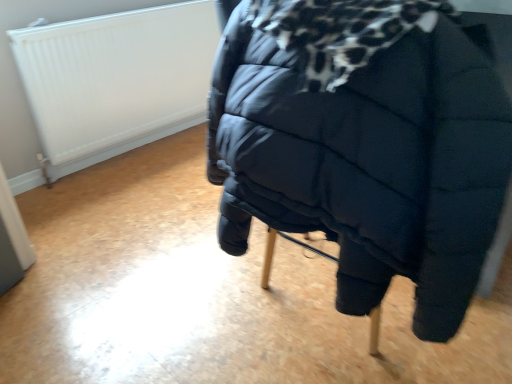
In order to face black quilted bed at center, should I rotate leftwards or rightwards?

Rotate your view right by about 10.780°.

Identify the location of black quilted bed at center. The height and width of the screenshot is (384, 512). (367, 145).

What do you see at coordinates (367, 145) in the screenshot? I see `black quilted bed at center` at bounding box center [367, 145].

You are a GUI agent. You are given a task and a screenshot of the screen. Output one action in this format:
    pyautogui.click(x=<x>, y=<y>)
    Task: Click on the white textured radiator at upper left
    Image resolution: width=512 pixels, height=384 pixels.
    Given the screenshot: What is the action you would take?
    pyautogui.click(x=116, y=79)

The height and width of the screenshot is (384, 512). What do you see at coordinates (116, 79) in the screenshot? I see `white textured radiator at upper left` at bounding box center [116, 79].

Locate an element on the screen. black quilted bed at center is located at coordinates (367, 145).

Does black quilted bed at center appear on the left side of white textured radiator at upper left?

No, black quilted bed at center is not to the left of white textured radiator at upper left.

Relative to white textured radiator at upper left, is black quilted bed at center in front or behind?

Visually, black quilted bed at center is located in front of white textured radiator at upper left.

Between point (395, 169) and point (94, 30), which one is positioned behind?

The point (94, 30) is more distant.

From the image's perspective, which one is positioned lower, black quilted bed at center or white textured radiator at upper left?

black quilted bed at center is shown below in the image.

From a real-world perspective, is black quilted bed at center below white textured radiator at upper left?

No, from a real-world perspective, black quilted bed at center is not beneath white textured radiator at upper left.

Between black quilted bed at center and white textured radiator at upper left, which one has larger width?

black quilted bed at center is wider.

Can you confirm if black quilted bed at center is shorter than white textured radiator at upper left?

Yes.

Considering the sizes of black quilted bed at center and white textured radiator at upper left in the image, is black quilted bed at center bigger or smaller than white textured radiator at upper left?

Clearly, black quilted bed at center is larger in size than white textured radiator at upper left.

Is black quilted bed at center completely or partially outside of white textured radiator at upper left?

Absolutely, black quilted bed at center is external to white textured radiator at upper left.

Is black quilted bed at center far away from white textured radiator at upper left?

Yes, black quilted bed at center and white textured radiator at upper left are quite far apart.

Is black quilted bed at center facing towards white textured radiator at upper left?

No, black quilted bed at center is not turned towards white textured radiator at upper left.

In the scene shown: Can you tell me how much black quilted bed at center and white textured radiator at upper left differ in facing direction?

90.9 degrees separate the facing orientations of black quilted bed at center and white textured radiator at upper left.

Locate an element on the screen. The height and width of the screenshot is (384, 512). radiator above the black quilted bed at center (from the image's perspective) is located at coordinates (116, 79).

In the scene shown: In the image, is white textured radiator at upper left on the left side or the right side of black quilted bed at center?

white textured radiator at upper left is to the left of black quilted bed at center.

Is the position of white textured radiator at upper left more distant than that of black quilted bed at center?

Yes, white textured radiator at upper left is further from the camera.

Between point (186, 63) and point (494, 197), which one is positioned in front?

The point (494, 197) is in front.

From the image's perspective, does white textured radiator at upper left appear higher than black quilted bed at center?

Correct, white textured radiator at upper left appears higher than black quilted bed at center in the image.

From a real-world perspective, is white textured radiator at upper left above or below black quilted bed at center?

white textured radiator at upper left is situated lower than black quilted bed at center in the real world.

Can you confirm if white textured radiator at upper left is wider than black quilted bed at center?

In fact, white textured radiator at upper left might be narrower than black quilted bed at center.

Considering the sizes of white textured radiator at upper left and black quilted bed at center in the image, is white textured radiator at upper left taller or shorter than black quilted bed at center?

Considering their sizes, white textured radiator at upper left has more height than black quilted bed at center.

Considering the sizes of objects white textured radiator at upper left and black quilted bed at center in the image provided, who is bigger, white textured radiator at upper left or black quilted bed at center?

Bigger between the two is black quilted bed at center.

Would you say white textured radiator at upper left is inside or outside black quilted bed at center?

white textured radiator at upper left is located beyond the bounds of black quilted bed at center.

Can you see white textured radiator at upper left touching black quilted bed at center?

No, white textured radiator at upper left is not next to black quilted bed at center.

Is white textured radiator at upper left oriented away from black quilted bed at center?

No, black quilted bed at center is not at the back of white textured radiator at upper left.

Looking at this image, how many degrees apart are the facing directions of white textured radiator at upper left and black quilted bed at center?

The angular difference between white textured radiator at upper left and black quilted bed at center is 90.9 degrees.

Identify the location of radiator that is under the black quilted bed at center (from a real-world perspective). The width and height of the screenshot is (512, 384). (116, 79).

Identify the location of furniture on the right of the white textured radiator at upper left. (367, 145).

Where is `radiator that appears above the black quilted bed at center (from the image's perspective)`? The image size is (512, 384). radiator that appears above the black quilted bed at center (from the image's perspective) is located at coordinates (116, 79).